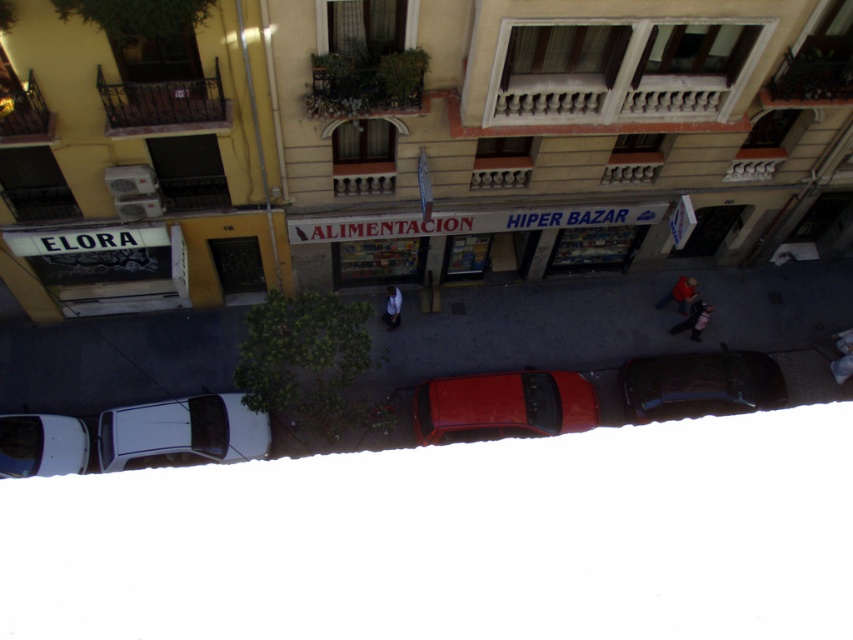
You are standing on a balcony overlooking the street. You see the shiny red car at center and the dark gray fabric jacket at lower right. Which object is nearer to you?

The shiny red car at center is closer to the viewer than the dark gray fabric jacket at lower right.

You are a delivery person who needs to decide whether to take a package from the matte red helmet at center to the light blue jeans at center. Considering their sizes, which one is easier to reach?

The matte red helmet at center has a larger size compared to light blue jeans at center, so it is easier to reach the matte red helmet at center.

Based on the photo, you are standing on the balcony and see the point marked at coordinates (502, 406). What object is located at that point?

The point at coordinates (502, 406) corresponds to the shiny red car at center.